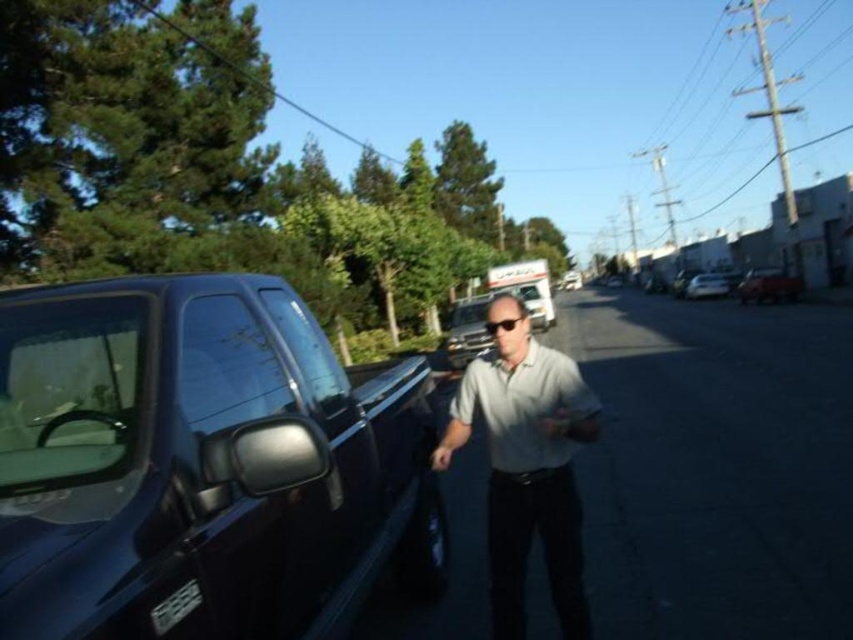
You are a pedestrian standing at the edge of the road in the scene. You see the matte black truck at center and the white glossy car at center. Which vehicle is closer to you?

The matte black truck at center is closer to you because it is in front of the white glossy car at center.

In the scene shown: You are a delivery person who needs to hand a package to the man in the gray cotton shirt at center. The delivery point is marked by point (526, 465). Can you confirm the location of the gray cotton shirt at center relative to the delivery point?

The gray cotton shirt at center is exactly at the delivery point marked by point (526, 465), so you can hand the package directly there.

You are a pedestrian standing at the edge of the road. You see a matte black truck at center and a gray cotton shirt at center. Which object is closer to the ground?

The gray cotton shirt at center is located below matte black truck at center, so the gray cotton shirt at center is closer to the ground.